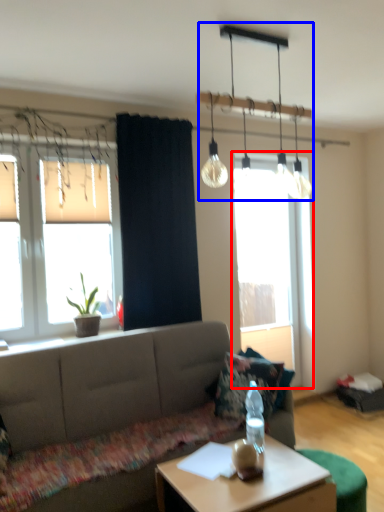
Question: Which of the following is the closest to the observer, window (highlighted by a red box) or chandelier (highlighted by a blue box)?

Choices:
 (A) window
 (B) chandelier

Answer: (B)